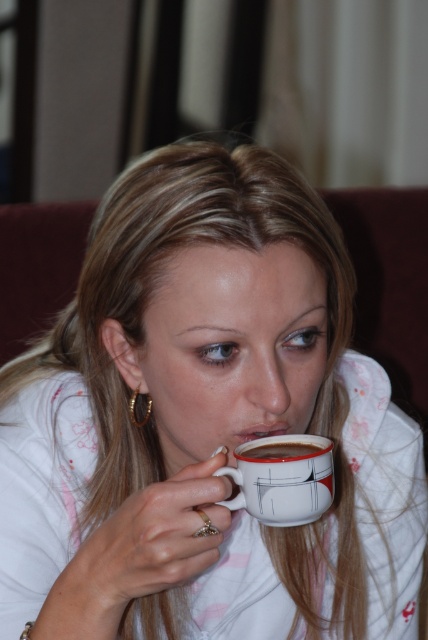
Is white glossy mug at center taller than white glossy mug at upper center?

Correct, white glossy mug at center is much taller as white glossy mug at upper center.

Can you confirm if white glossy mug at center is smaller than white glossy mug at upper center?

Incorrect, white glossy mug at center is not smaller in size than white glossy mug at upper center.

Who is more forward, (267, 493) or (297, 449)?

Point (267, 493) is more forward.

You are a GUI agent. You are given a task and a screenshot of the screen. Output one action in this format:
    pyautogui.click(x=<x>, y=<y>)
    Task: Click on the white glossy mug at center
    This screenshot has width=428, height=640.
    Given the screenshot: What is the action you would take?
    pyautogui.click(x=282, y=477)